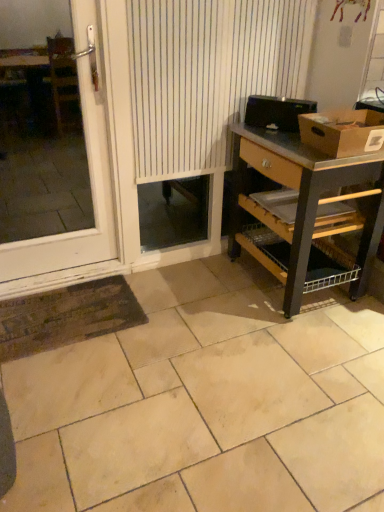
This screenshot has height=512, width=384. Find the location of `blank space above beige ceramic tile at center (from a real-world perspective)`. blank space above beige ceramic tile at center (from a real-world perspective) is located at coordinates (195, 393).